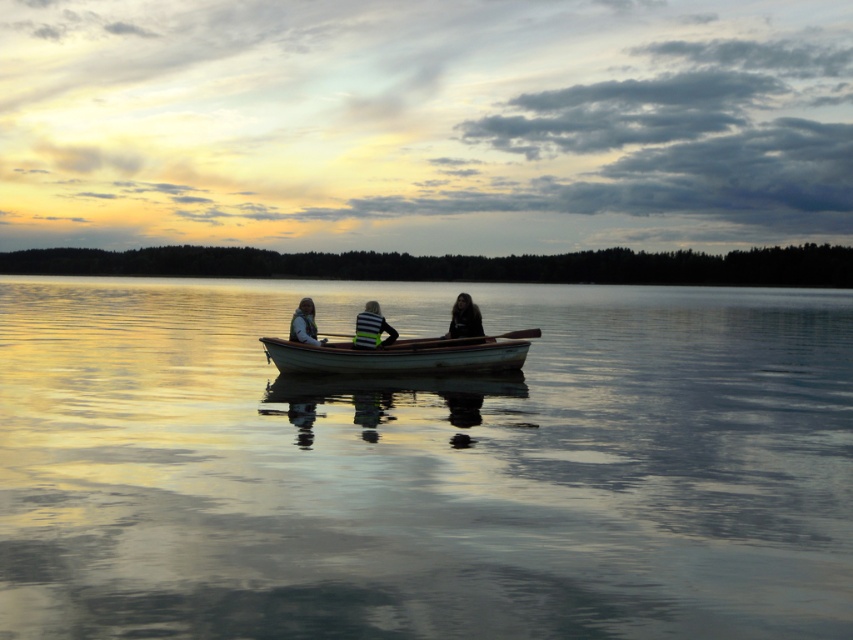
Locate an element on the screen. smooth water at center is located at coordinates (422, 465).

Is point (165, 557) farther from viewer compared to point (366, 352)?

No, (165, 557) is closer to viewer.

Where is `smooth water at center`? Image resolution: width=853 pixels, height=640 pixels. smooth water at center is located at coordinates (422, 465).

Is striped fabric shirt at center taller than dark hair at center?

Yes, striped fabric shirt at center is taller than dark hair at center.

Between striped fabric shirt at center and dark hair at center, which one is positioned higher?

Positioned higher is dark hair at center.

The image size is (853, 640). What do you see at coordinates (370, 328) in the screenshot?
I see `striped fabric shirt at center` at bounding box center [370, 328].

You are a GUI agent. You are given a task and a screenshot of the screen. Output one action in this format:
    pyautogui.click(x=<x>, y=<y>)
    Task: Click on the striped fabric shirt at center
    The image size is (853, 640).
    Given the screenshot: What is the action you would take?
    pyautogui.click(x=370, y=328)

Is wooden canoe at center positioned before striped fabric shirt at center?

Yes, wooden canoe at center is in front of striped fabric shirt at center.

Who is more distant from viewer, (422, 340) or (390, 340)?

The point (422, 340) is behind.

Identify the location of wooden canoe at center. The height and width of the screenshot is (640, 853). (404, 355).